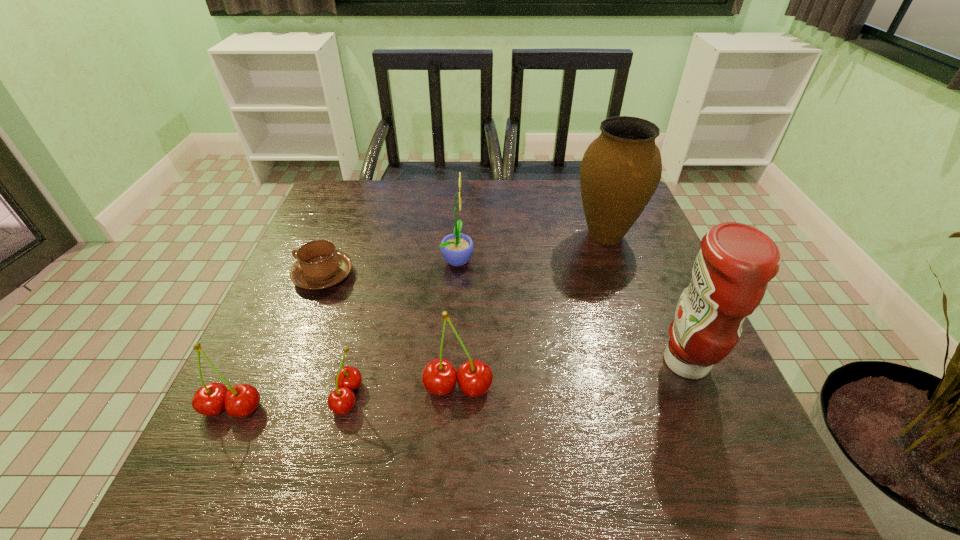
Image resolution: width=960 pixels, height=540 pixels. Identify the location of object that is at the far right corner. (620, 171).

Where is `object located at the near right corner`? The image size is (960, 540). object located at the near right corner is located at coordinates (730, 275).

Image resolution: width=960 pixels, height=540 pixels. In order to click on vacant area at the far edge in this screenshot , I will do (414, 192).

At what (x,y) coordinates should I click in order to perform the action: click on vacant space at the near edge of the desktop. Please return your answer as a coordinate pair (x, y). The width and height of the screenshot is (960, 540). Looking at the image, I should click on (552, 428).

Where is `vacant position at the left edge of the desktop`? Image resolution: width=960 pixels, height=540 pixels. vacant position at the left edge of the desktop is located at coordinates (366, 227).

This screenshot has width=960, height=540. Find the location of `free location at the right edge of the desktop`. free location at the right edge of the desktop is located at coordinates (673, 380).

Locate an element on the screen. free spot at the near right corner of the desktop is located at coordinates (654, 393).

The image size is (960, 540). Identify the location of free point between the sunflower and the cappuccino. [391, 267].

Identify the location of free space between the fifth object from right to left and the rightmost cherry. The width and height of the screenshot is (960, 540). (403, 392).

Image resolution: width=960 pixels, height=540 pixels. Identify the location of vacant space that is in between the urn and the second cherry from left to right. (476, 316).